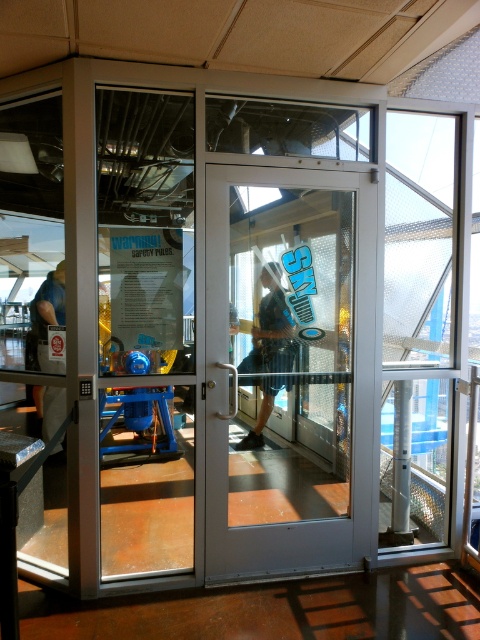
You are standing outside the skydiving facility and want to enter. You see the white glossy door at center and the blue denim shorts at center. Which object is closer to your right side?

The white glossy door at center is positioned on the right side of blue denim shorts at center, so the white glossy door at center is closer to your right side.

You are standing outside the skydiving facility and want to enter through the entrance. Which object, the white glossy door at center or the matte black shirt at left, is closer to you as you face the entrance?

The white glossy door at center is closer to you because it is positioned under the matte black shirt at left, meaning the door is in front of the shirt in the scene.